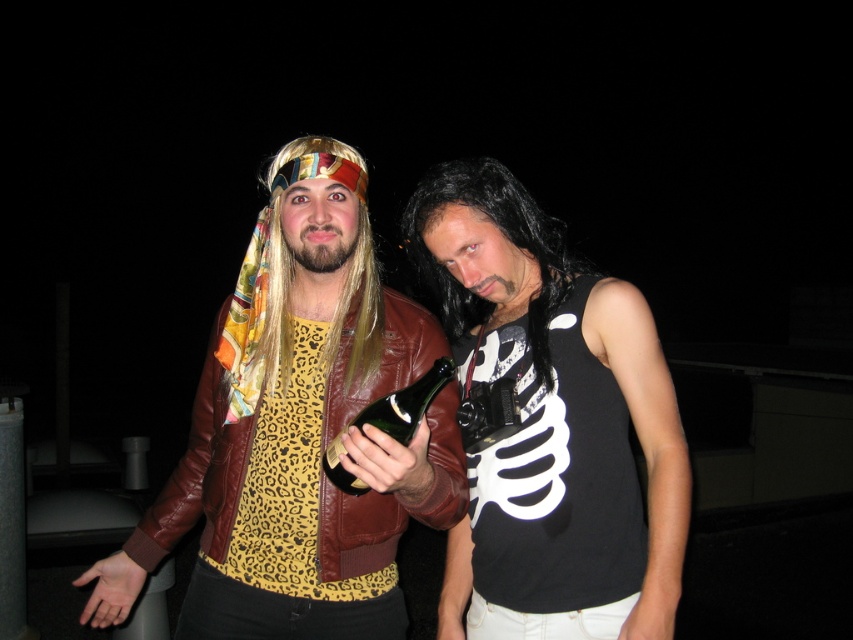
Does leather jacket at center appear over black matte tank top at center?

No.

Is point (289, 326) positioned behind point (440, 243)?

Yes, it is behind point (440, 243).

Where is `leather jacket at center`? This screenshot has width=853, height=640. leather jacket at center is located at coordinates (299, 435).

Does point (575, 260) come in front of point (431, 381)?

No.

Does black silky hair at center come in front of green glass bottle at center?

No, black silky hair at center is behind green glass bottle at center.

At what (x,y) coordinates should I click in order to perform the action: click on black silky hair at center. Please return your answer as a coordinate pair (x, y). The height and width of the screenshot is (640, 853). Looking at the image, I should click on (505, 236).

Does leather jacket at center have a greater height compared to black silky hair at center?

Indeed, leather jacket at center has a greater height compared to black silky hair at center.

Does leather jacket at center appear on the left side of black silky hair at center?

Correct, you'll find leather jacket at center to the left of black silky hair at center.

Does point (273, 596) lie in front of point (531, 346)?

No.

Find the location of a particular element. This screenshot has height=640, width=853. leather jacket at center is located at coordinates (299, 435).